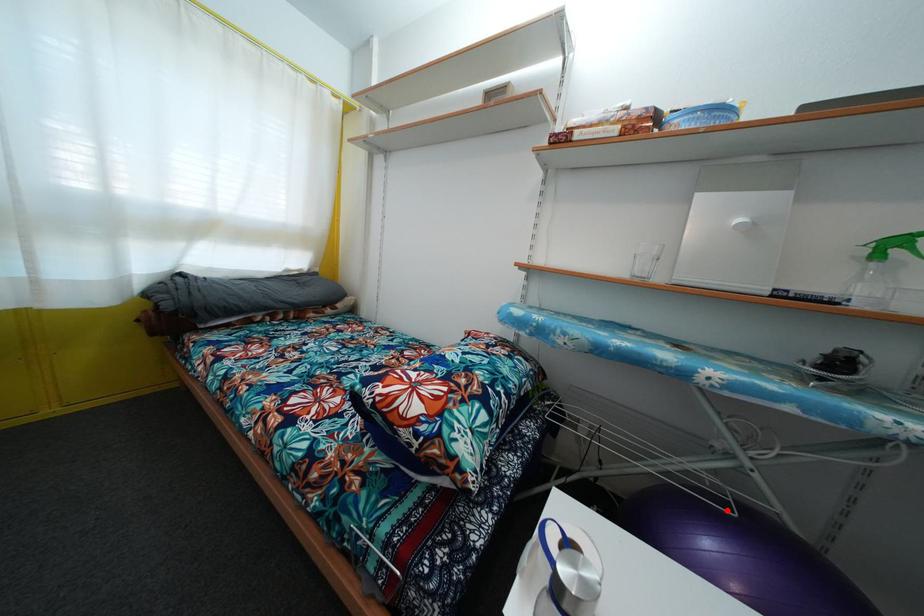
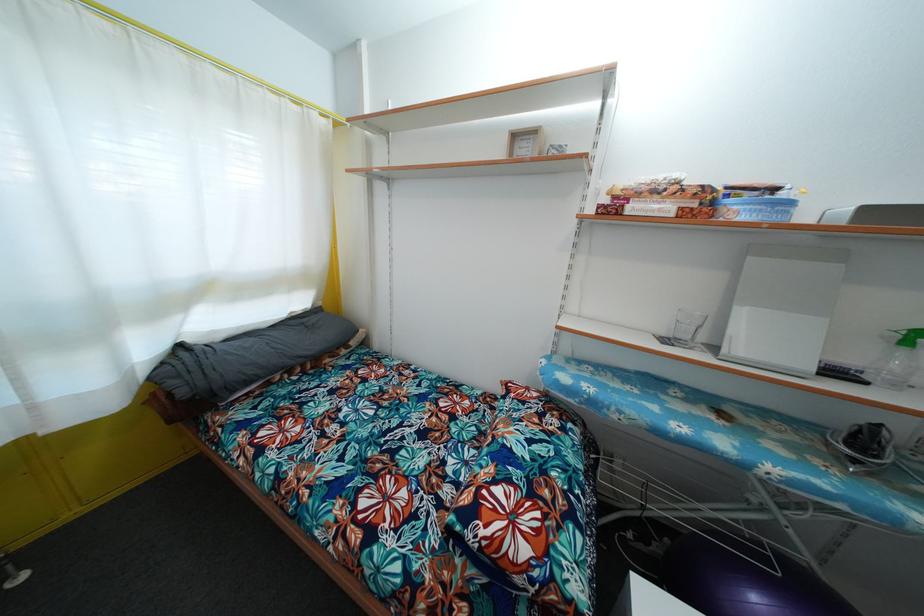
Question: I am providing you with two images of the same scene from different viewpoints. Image1 has a red point marked. In image2, the corresponding 3D location appears at what relative position? Reply with the corresponding letter.

Choices:
 (A) Closer
 (B) Farther

Answer: (A)